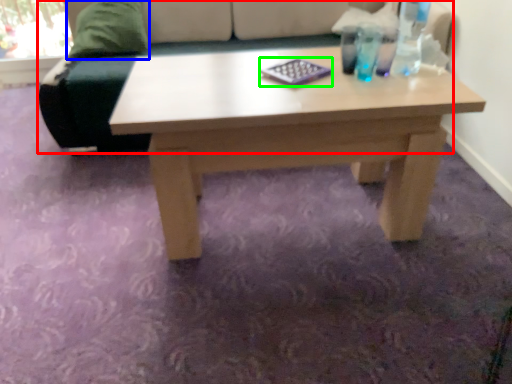
Question: Considering the real-world distances, which object is farthest from studio couch (highlighted by a red box)? pillow (highlighted by a blue box) or pad (highlighted by a green box)?

Choices:
 (A) pillow
 (B) pad

Answer: (B)